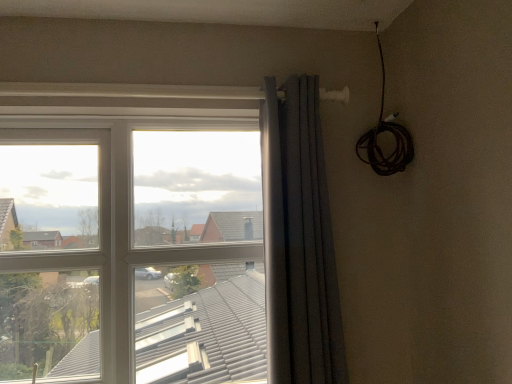
Describe the element at coordinates (309, 241) in the screenshot. The image size is (512, 384). I see `dark gray textured curtain at center` at that location.

Image resolution: width=512 pixels, height=384 pixels. What are the coordinates of `dark gray textured curtain at center` in the screenshot? It's located at (309, 241).

Describe the element at coordinates (131, 243) in the screenshot. I see `transparent glass window at center` at that location.

At what (x,y) coordinates should I click in order to perform the action: click on transparent glass window at center. Please return your answer as a coordinate pair (x, y). The image size is (512, 384). Looking at the image, I should click on (131, 243).

The image size is (512, 384). Identify the location of dark gray textured curtain at center. (309, 241).

Based on the photo, visually, is dark gray textured curtain at center positioned to the left or to the right of transparent glass window at center?

Based on their positions, dark gray textured curtain at center is located to the right of transparent glass window at center.

In the image, is dark gray textured curtain at center positioned in front of or behind transparent glass window at center?

In the image, dark gray textured curtain at center appears in front of transparent glass window at center.

Does point (324, 275) come behind point (2, 128)?

No, it is not.

From the image's perspective, between dark gray textured curtain at center and transparent glass window at center, who is located below?

transparent glass window at center is shown below in the image.

From a real-world perspective, does dark gray textured curtain at center stand above transparent glass window at center?

Yes, from a real-world perspective, dark gray textured curtain at center is above transparent glass window at center.

Does dark gray textured curtain at center have a greater width compared to transparent glass window at center?

Incorrect, the width of dark gray textured curtain at center does not surpass that of transparent glass window at center.

Is dark gray textured curtain at center taller than transparent glass window at center?

No, dark gray textured curtain at center is not taller than transparent glass window at center.

Does dark gray textured curtain at center have a larger size compared to transparent glass window at center?

No, dark gray textured curtain at center is not bigger than transparent glass window at center.

Is dark gray textured curtain at center outside of transparent glass window at center?

dark gray textured curtain at center is positioned outside transparent glass window at center.

Is dark gray textured curtain at center not close to transparent glass window at center?

No, dark gray textured curtain at center is not far from transparent glass window at center.

Does dark gray textured curtain at center turn towards transparent glass window at center?

No, dark gray textured curtain at center is not turned towards transparent glass window at center.

You are a GUI agent. You are given a task and a screenshot of the screen. Output one action in this format:
    pyautogui.click(x=<x>, y=<y>)
    Task: Click on the window behind the dark gray textured curtain at center
    
    Given the screenshot: What is the action you would take?
    pyautogui.click(x=131, y=243)

Which object is positioned more to the right, transparent glass window at center or dark gray textured curtain at center?

dark gray textured curtain at center is more to the right.

Between transparent glass window at center and dark gray textured curtain at center, which one is positioned behind?

Positioned behind is transparent glass window at center.

Is point (275, 212) farther from viewer compared to point (305, 283)?

Yes.

From the image's perspective, is transparent glass window at center positioned above or below dark gray textured curtain at center?

transparent glass window at center is situated lower than dark gray textured curtain at center in the image.

Looking at this image, from a real-world perspective, who is located lower, transparent glass window at center or dark gray textured curtain at center?

transparent glass window at center, from a real-world perspective.

Is transparent glass window at center wider or thinner than dark gray textured curtain at center?

In the image, transparent glass window at center appears to be wider than dark gray textured curtain at center.

Does transparent glass window at center have a greater height compared to dark gray textured curtain at center?

Yes, transparent glass window at center is taller than dark gray textured curtain at center.

Between transparent glass window at center and dark gray textured curtain at center, which one has larger size?

transparent glass window at center.

Is dark gray textured curtain at center surrounded by transparent glass window at center?

Actually, dark gray textured curtain at center is outside transparent glass window at center.

Is transparent glass window at center far away from dark gray textured curtain at center?

That's not correct — transparent glass window at center is a little close to dark gray textured curtain at center.

Does transparent glass window at center turn towards dark gray textured curtain at center?

Yes, transparent glass window at center is aimed at dark gray textured curtain at center.

What's the angular difference between transparent glass window at center and dark gray textured curtain at center's facing directions?

9.02 degrees separate the facing orientations of transparent glass window at center and dark gray textured curtain at center.

How far apart are transparent glass window at center and dark gray textured curtain at center?

transparent glass window at center and dark gray textured curtain at center are 16.28 inches apart.

You are a GUI agent. You are given a task and a screenshot of the screen. Output one action in this format:
    pyautogui.click(x=<x>, y=<y>)
    Task: Click on the window beneath the dark gray textured curtain at center (from a real-world perspective)
    
    Given the screenshot: What is the action you would take?
    pyautogui.click(x=131, y=243)

Where is `curtain in front of the transparent glass window at center`? This screenshot has height=384, width=512. curtain in front of the transparent glass window at center is located at coordinates (309, 241).

Identify the location of window below the dark gray textured curtain at center (from the image's perspective). Image resolution: width=512 pixels, height=384 pixels. (131, 243).